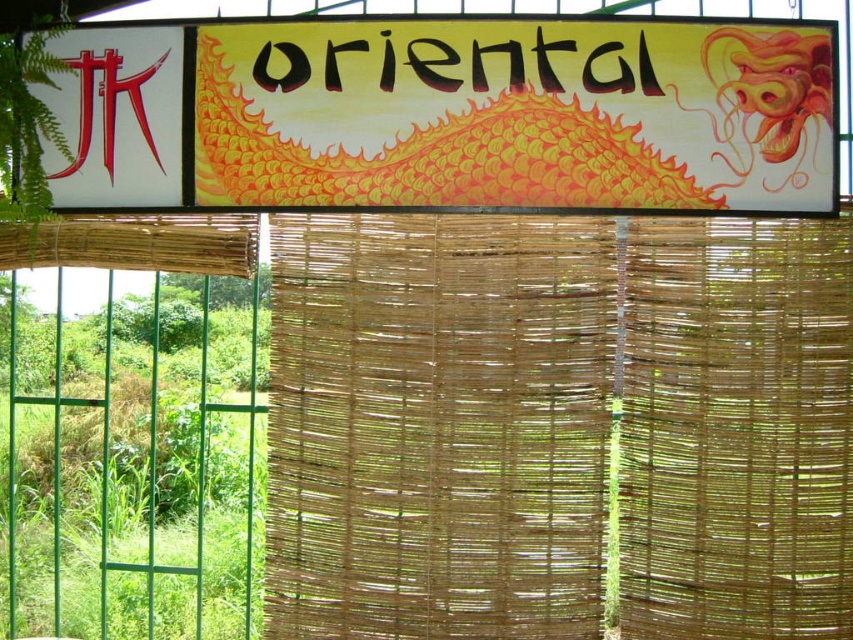
Question: In this image, where is natural woven bamboo at center located relative to blackmaterial/texture at upper center?

Choices:
 (A) left
 (B) right

Answer: (B)

Question: Which object is the closest to the matte yellow dragon at upper center?

Choices:
 (A) natural woven bamboo at center
 (B) blackmaterial/texture at upper center

Answer: (B)

Question: Observing the image, what is the correct spatial positioning of matte yellow dragon at upper center in reference to blackmaterial/texture at upper center?

Choices:
 (A) left
 (B) right

Answer: (A)

Question: Is natural woven bamboo at center below matte yellow dragon at upper center?

Choices:
 (A) yes
 (B) no

Answer: (A)

Question: Estimate the real-world distances between objects in this image. Which object is closer to the natural woven bamboo at center?

Choices:
 (A) blackmaterial/texture at upper center
 (B) matte yellow dragon at upper center

Answer: (B)

Question: Considering the real-world distances, which object is farthest from the blackmaterial/texture at upper center?

Choices:
 (A) matte yellow dragon at upper center
 (B) natural woven bamboo at center

Answer: (B)